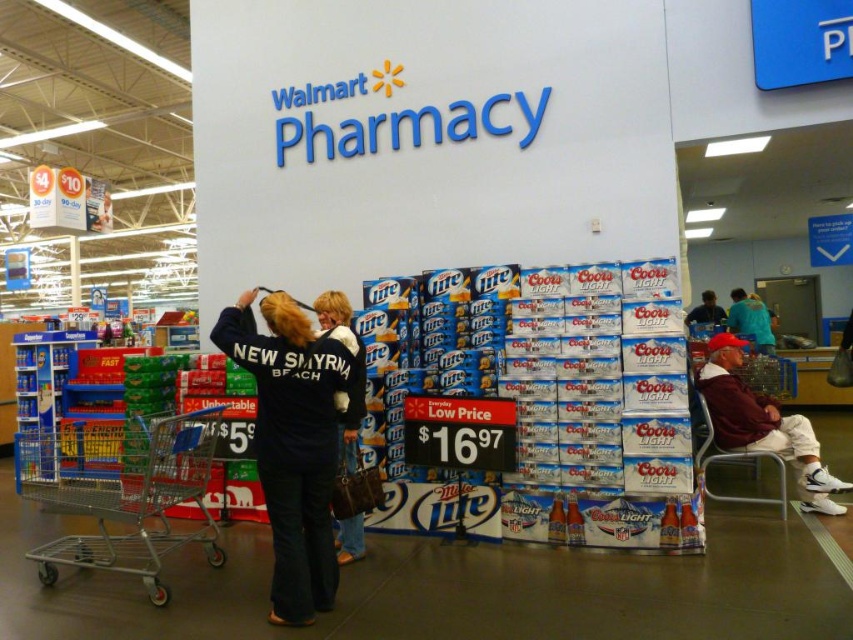
Is the position of dark blue denim jacket at center more distant than that of teal fabric shirt at center?

That is False.

Is dark blue denim jacket at center smaller than teal fabric shirt at center?

Yes.

In order to click on dark blue denim jacket at center in this screenshot , I will do `click(350, 372)`.

Locate an element on the screen. dark blue denim jacket at center is located at coordinates (350, 372).

Which of these two, metallic silver shopping cart at lower left or white cotton pants at lower right, stands shorter?

With less height is metallic silver shopping cart at lower left.

Is point (142, 492) less distant than point (747, 433)?

Yes, it is in front of point (747, 433).

Where is `metallic silver shopping cart at lower left`? metallic silver shopping cart at lower left is located at coordinates (125, 493).

Which of these two, metallic silver shopping cart at lower left or teal fabric shirt at center, stands shorter?

teal fabric shirt at center is shorter.

Which is more to the right, metallic silver shopping cart at lower left or teal fabric shirt at center?

teal fabric shirt at center

Where is `metallic silver shopping cart at lower left`? The height and width of the screenshot is (640, 853). metallic silver shopping cart at lower left is located at coordinates (125, 493).